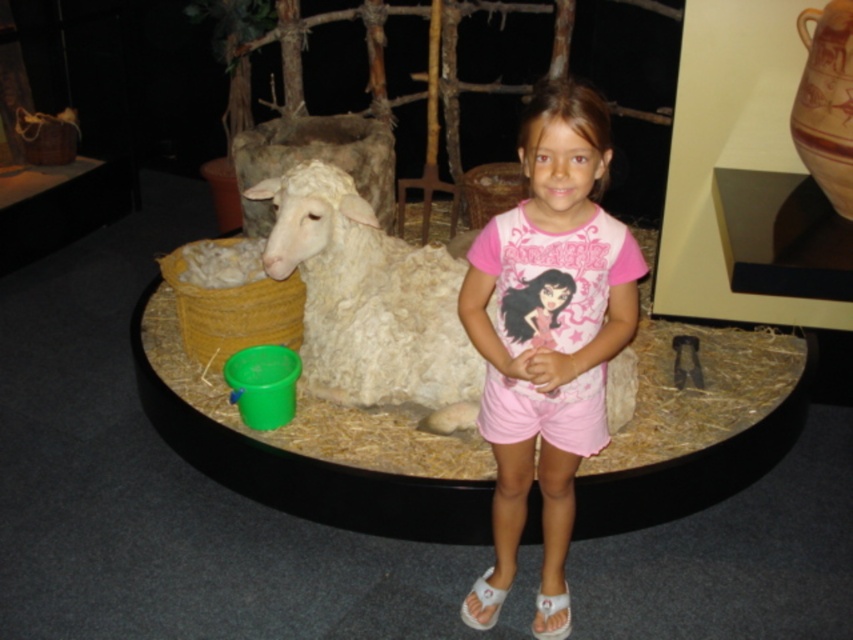
Question: Is pink cotton shorts at center positioned behind white woolen sheep at center?

Choices:
 (A) no
 (B) yes

Answer: (A)

Question: Does pink cotton shorts at center appear over white woolen sheep at center?

Choices:
 (A) no
 (B) yes

Answer: (A)

Question: Which point appears closest to the camera in this image?

Choices:
 (A) (368, 381)
 (B) (556, 204)

Answer: (B)

Question: Which point is farther from the camera taking this photo?

Choices:
 (A) (483, 307)
 (B) (358, 268)

Answer: (B)

Question: Is pink cotton shorts at center positioned at the back of white woolen sheep at center?

Choices:
 (A) no
 (B) yes

Answer: (A)

Question: Which point appears closest to the camera in this image?

Choices:
 (A) (518, 362)
 (B) (323, 172)

Answer: (A)